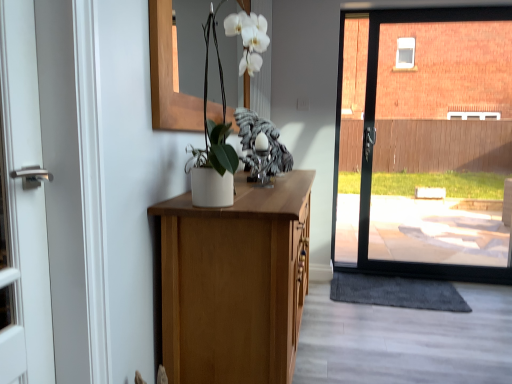
In order to face gray textured doormat at lower right, should I rotate leftwards or rightwards?

It's best to rotate right around 18.252 degrees.

At what (x,y) coordinates should I click in order to perform the action: click on gray textured doormat at lower right. Please return your answer as a coordinate pair (x, y). This screenshot has width=512, height=384. Looking at the image, I should click on (396, 292).

What do you see at coordinates (396, 292) in the screenshot? The height and width of the screenshot is (384, 512). I see `gray textured doormat at lower right` at bounding box center [396, 292].

Image resolution: width=512 pixels, height=384 pixels. Describe the element at coordinates (213, 142) in the screenshot. I see `white matte vase at center` at that location.

You are a GUI agent. You are given a task and a screenshot of the screen. Output one action in this format:
    pyautogui.click(x=<x>, y=<y>)
    Task: Click on the white matte vase at center
    The image size is (512, 384).
    Given the screenshot: What is the action you would take?
    [213, 142]

I want to click on gray textured doormat at lower right, so click(396, 292).

Between white matte vase at center and gray textured doormat at lower right, which one appears on the left side from the viewer's perspective?

Positioned to the left is white matte vase at center.

Which object is further away from the camera, white matte vase at center or gray textured doormat at lower right?

gray textured doormat at lower right is more distant.

Between point (207, 117) and point (377, 293), which one is positioned in front?

Positioned in front is point (207, 117).

From the image's perspective, is white matte vase at center over gray textured doormat at lower right?

Yes.

From a real-world perspective, is white matte vase at center located higher than gray textured doormat at lower right?

Yes, from a real-world perspective, white matte vase at center is above gray textured doormat at lower right.

Looking at this image, which of these two, white matte vase at center or gray textured doormat at lower right, is wider?

gray textured doormat at lower right is wider.

Does white matte vase at center have a greater height compared to gray textured doormat at lower right?

Yes, white matte vase at center is taller than gray textured doormat at lower right.

In the scene shown: Considering the sizes of white matte vase at center and gray textured doormat at lower right in the image, is white matte vase at center bigger or smaller than gray textured doormat at lower right?

Considering their sizes, white matte vase at center takes up more space than gray textured doormat at lower right.

Looking at this image, is gray textured doormat at lower right inside white matte vase at center?

No, gray textured doormat at lower right is not a part of white matte vase at center.

Is white matte vase at center in contact with gray textured doormat at lower right?

No, white matte vase at center is not with gray textured doormat at lower right.

Is white matte vase at center looking in the opposite direction of gray textured doormat at lower right?

No, white matte vase at center is not facing away from gray textured doormat at lower right.

Identify the location of floral arrangement above the gray textured doormat at lower right (from the image's perspective). The width and height of the screenshot is (512, 384). (213, 142).

Between gray textured doormat at lower right and white matte vase at center, which one appears on the left side from the viewer's perspective?

white matte vase at center.

Is gray textured doormat at lower right further to the viewer compared to white matte vase at center?

Yes, it is.

Is point (410, 301) more distant than point (202, 194)?

Yes, it is.

From the image's perspective, does gray textured doormat at lower right appear higher than white matte vase at center?

No.

From a real-world perspective, who is located higher, gray textured doormat at lower right or white matte vase at center?

white matte vase at center.

Considering the sizes of objects gray textured doormat at lower right and white matte vase at center in the image provided, who is wider, gray textured doormat at lower right or white matte vase at center?

Wider between the two is gray textured doormat at lower right.

Is gray textured doormat at lower right shorter than white matte vase at center?

Correct, gray textured doormat at lower right is not as tall as white matte vase at center.

Which of these two, gray textured doormat at lower right or white matte vase at center, is bigger?

white matte vase at center.

Is gray textured doormat at lower right spatially inside white matte vase at center, or outside of it?

gray textured doormat at lower right is not enclosed by white matte vase at center.

Is gray textured doormat at lower right next to white matte vase at center?

No, gray textured doormat at lower right is not making contact with white matte vase at center.

Is gray textured doormat at lower right oriented towards white matte vase at center?

No, gray textured doormat at lower right is not facing towards white matte vase at center.

The width and height of the screenshot is (512, 384). I want to click on floral arrangement to the left of gray textured doormat at lower right, so click(x=213, y=142).

Identify the location of floral arrangement above the gray textured doormat at lower right (from the image's perspective). Image resolution: width=512 pixels, height=384 pixels. (213, 142).

Where is `doormat below the white matte vase at center (from the image's perspective)`? doormat below the white matte vase at center (from the image's perspective) is located at coordinates (396, 292).